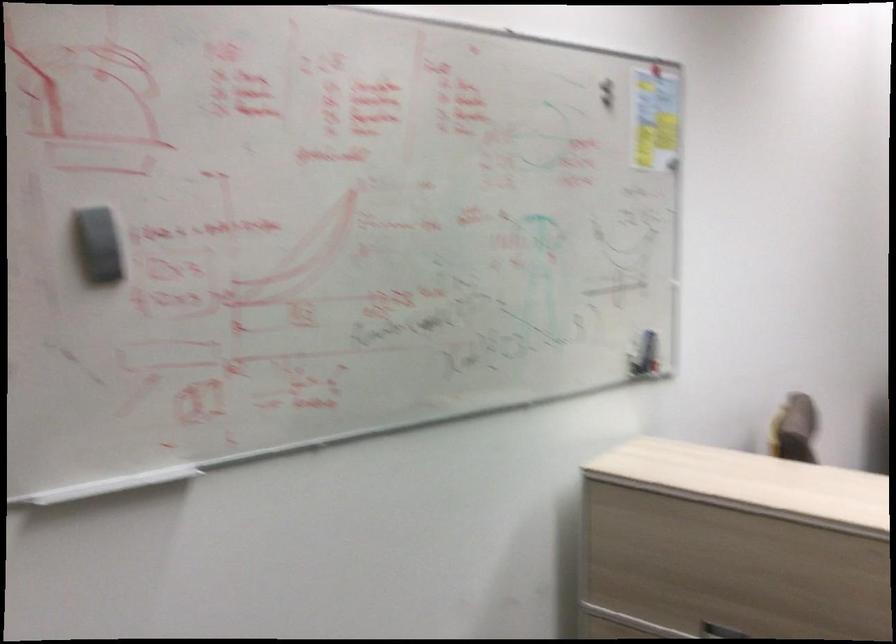
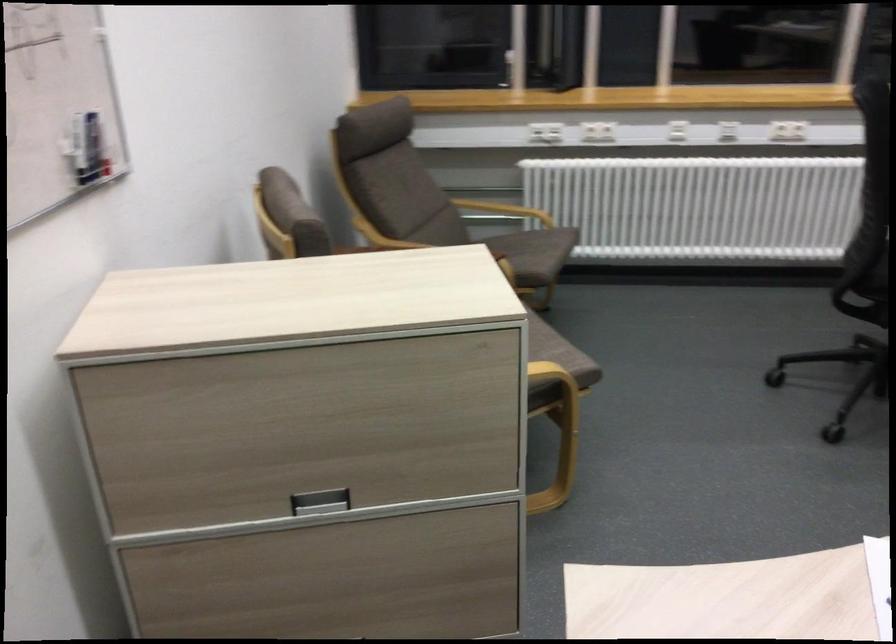
The images are taken continuously from a first-person perspective. In which direction is your viewpoint rotating?

The camera's rotation is toward right-down.